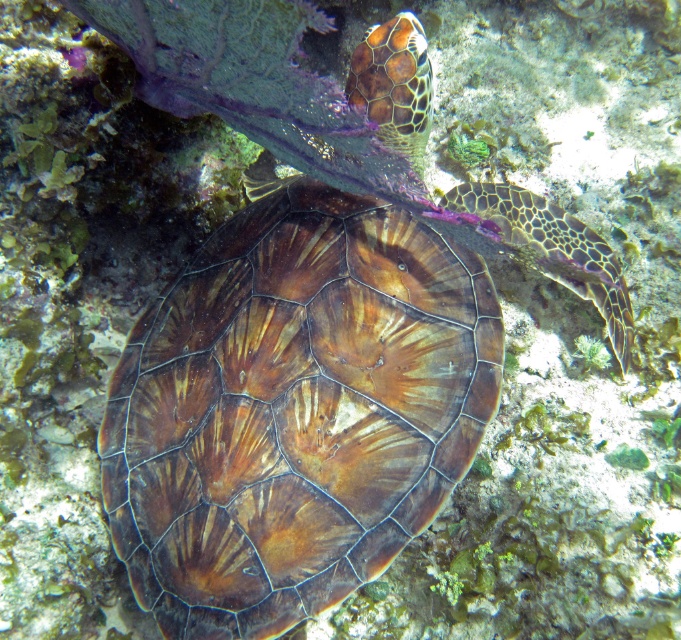
Can you confirm if brown leathery shell at center is bigger than leathery brown tortoise at center?

Yes, brown leathery shell at center is bigger than leathery brown tortoise at center.

The width and height of the screenshot is (681, 640). Identify the location of brown leathery shell at center. (294, 410).

This screenshot has height=640, width=681. Identify the location of brown leathery shell at center. point(294,410).

From the picture: Between brown leathery shell at center and brown textured shell at upper center, which one has more height?

With more height is brown leathery shell at center.

Image resolution: width=681 pixels, height=640 pixels. What do you see at coordinates (294, 410) in the screenshot?
I see `brown leathery shell at center` at bounding box center [294, 410].

This screenshot has height=640, width=681. Identify the location of brown leathery shell at center. (294, 410).

Which is behind, point (592, 280) or point (427, 70)?

The point (592, 280) is behind.

Where is `leathery brown tortoise at center`? The width and height of the screenshot is (681, 640). leathery brown tortoise at center is located at coordinates (554, 250).